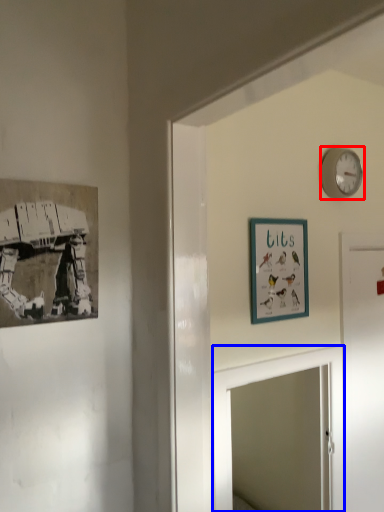
Question: Which object is further to the camera taking this photo, wall clock (highlighted by a red box) or mirror (highlighted by a blue box)?

Choices:
 (A) wall clock
 (B) mirror

Answer: (A)